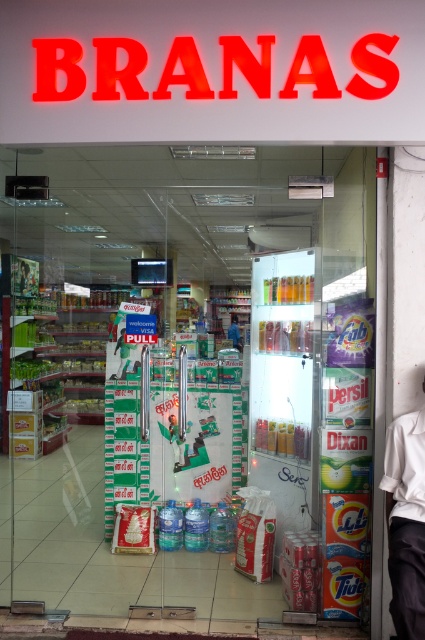
Question: Can you confirm if transparent plastic glass door at center is thinner than white fabric shirt at right?

Choices:
 (A) yes
 (B) no

Answer: (B)

Question: Which of the following is the closest to the observer?

Choices:
 (A) (408, 572)
 (B) (238, 339)

Answer: (A)

Question: Estimate the real-world distances between objects in this image. Which object is farther from the blue fabric shirt at center?

Choices:
 (A) transparent plastic glass door at center
 (B) white fabric shirt at right

Answer: (B)

Question: Does transparent plastic glass door at center appear under white fabric shirt at right?

Choices:
 (A) yes
 (B) no

Answer: (B)

Question: Among these points, which one is nearest to the camera?

Choices:
 (A) (238, 330)
 (B) (294, 484)

Answer: (B)

Question: Does white fabric shirt at right have a greater width compared to blue fabric shirt at center?

Choices:
 (A) no
 (B) yes

Answer: (B)